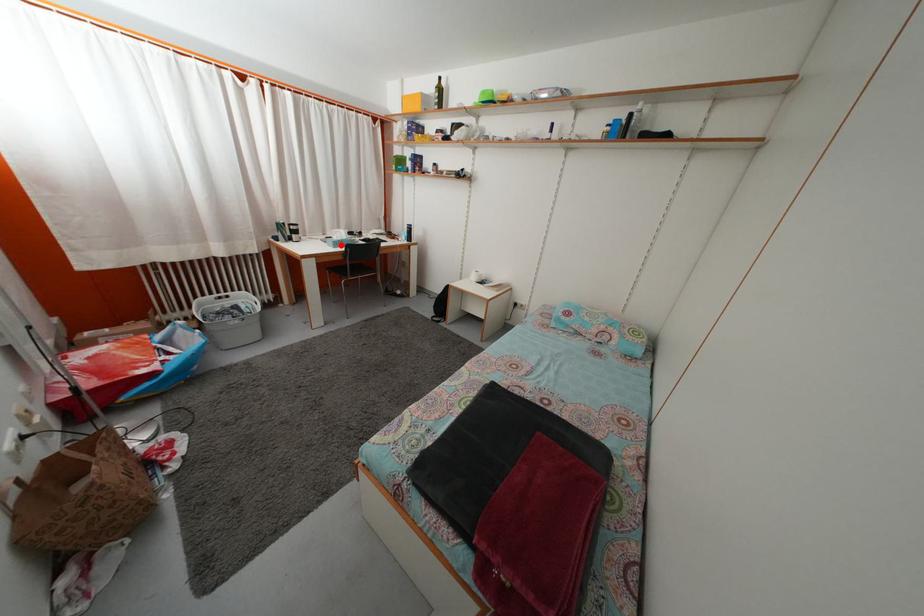
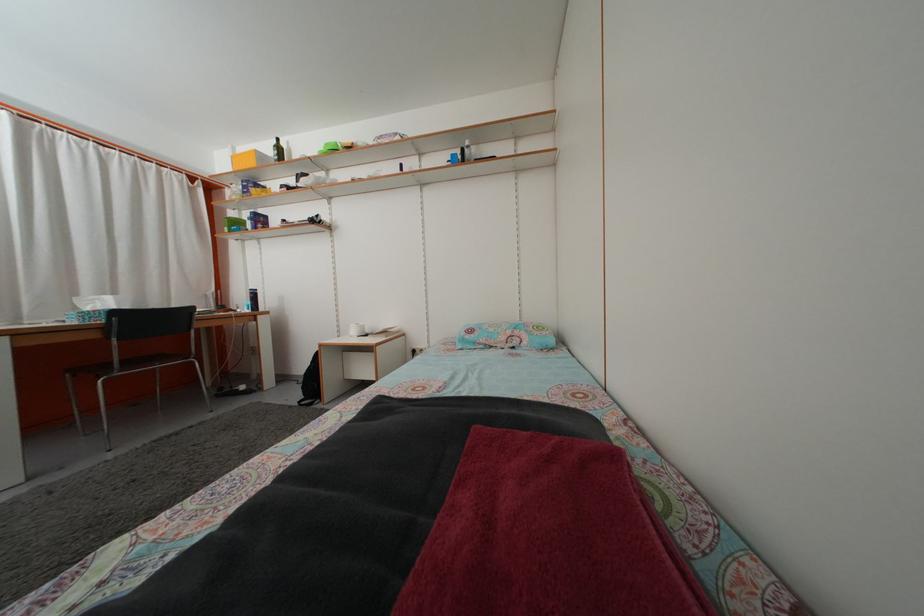
The point at the highlighted location is marked in the first image. Where is the corresponding point in the second image?

(94, 317)